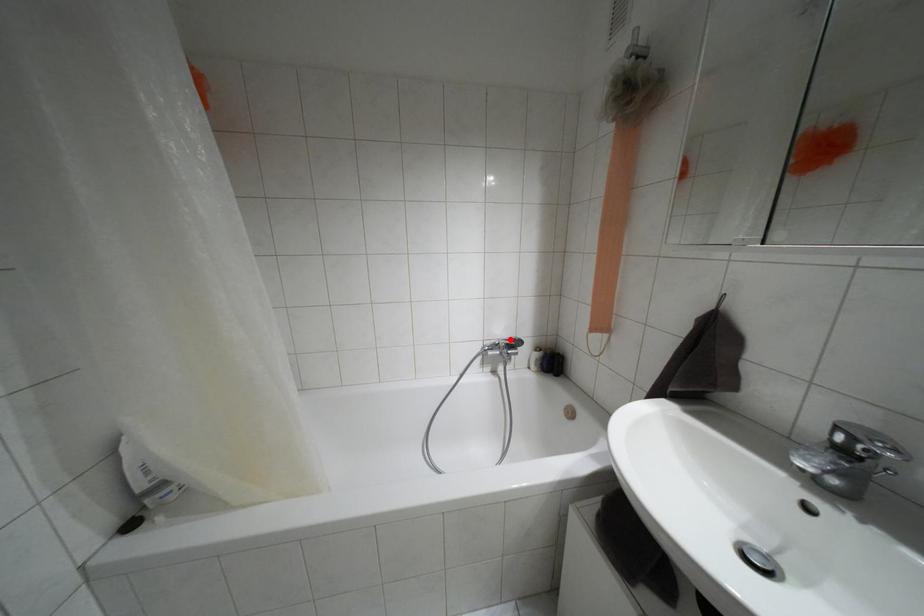
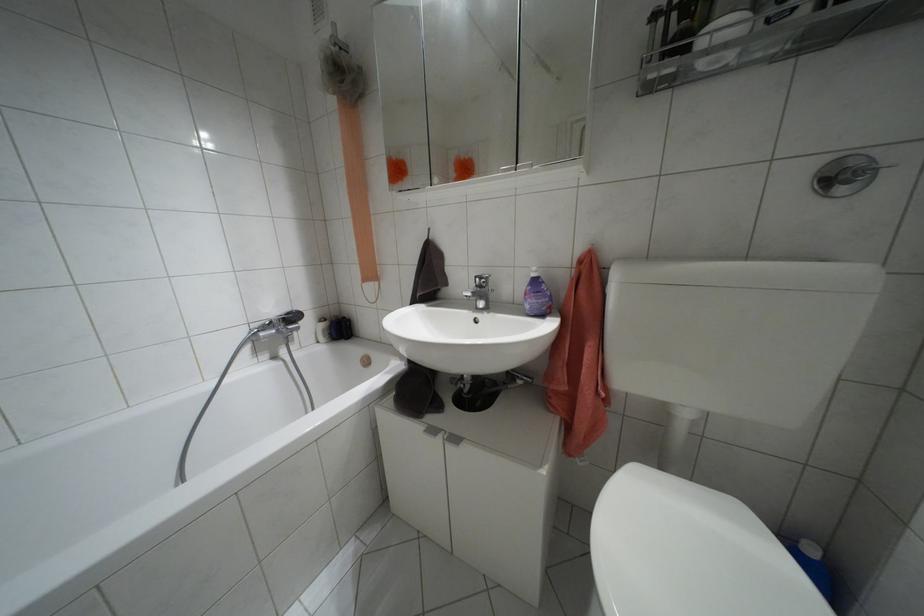
Find the pixel in the second image that matches the highlighted location in the first image.

(286, 313)